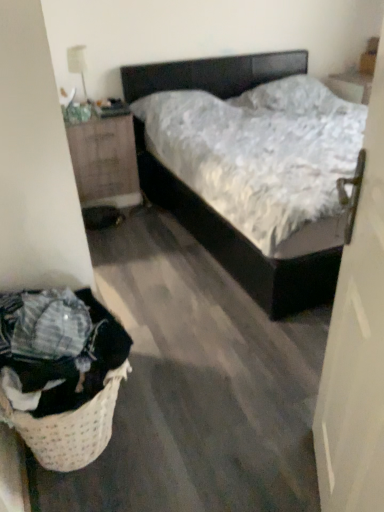
Question: Should I look upward or downward to see wooden nightstand at left?

Choices:
 (A) up
 (B) down

Answer: (A)

Question: From the image's perspective, is white glossy lamp at upper left over woven beige laundry basket at lower left?

Choices:
 (A) yes
 (B) no

Answer: (A)

Question: Is white glossy lamp at upper left completely or partially outside of woven beige laundry basket at lower left?

Choices:
 (A) no
 (B) yes

Answer: (B)

Question: Is white glossy lamp at upper left thinner than woven beige laundry basket at lower left?

Choices:
 (A) no
 (B) yes

Answer: (B)

Question: Is white glossy lamp at upper left beside woven beige laundry basket at lower left?

Choices:
 (A) no
 (B) yes

Answer: (A)

Question: Does white glossy lamp at upper left have a greater height compared to woven beige laundry basket at lower left?

Choices:
 (A) yes
 (B) no

Answer: (B)

Question: Is white glossy lamp at upper left in front of woven beige laundry basket at lower left?

Choices:
 (A) yes
 (B) no

Answer: (B)

Question: From the image's perspective, is white matte door at right over wooden nightstand at left?

Choices:
 (A) yes
 (B) no

Answer: (B)

Question: Considering the relative sizes of white matte door at right and wooden nightstand at left in the image provided, is white matte door at right taller than wooden nightstand at left?

Choices:
 (A) no
 (B) yes

Answer: (B)

Question: Considering the relative sizes of white matte door at right and wooden nightstand at left in the image provided, is white matte door at right wider than wooden nightstand at left?

Choices:
 (A) yes
 (B) no

Answer: (B)

Question: Does white matte door at right have a smaller size compared to wooden nightstand at left?

Choices:
 (A) yes
 (B) no

Answer: (A)

Question: From the image's perspective, would you say white matte door at right is shown under wooden nightstand at left?

Choices:
 (A) no
 (B) yes

Answer: (B)

Question: Can you confirm if white matte door at right is positioned to the right of wooden nightstand at left?

Choices:
 (A) yes
 (B) no

Answer: (A)

Question: From a real-world perspective, is white glossy lamp at upper left physically above white matte door at right?

Choices:
 (A) yes
 (B) no

Answer: (A)